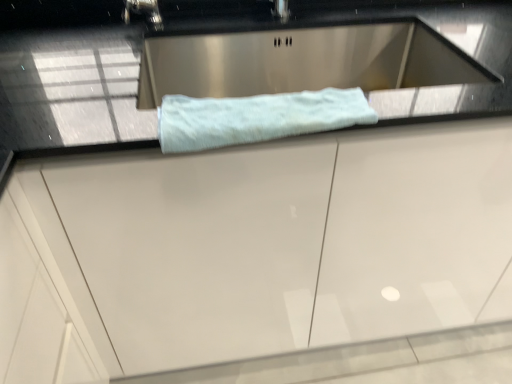
Question: Is white glossy cabinet at center oriented towards light blue plush towel at center?

Choices:
 (A) no
 (B) yes

Answer: (A)

Question: Is white glossy cabinet at center placed right next to light blue plush towel at center?

Choices:
 (A) yes
 (B) no

Answer: (B)

Question: Can you confirm if white glossy cabinet at center is shorter than light blue plush towel at center?

Choices:
 (A) no
 (B) yes

Answer: (A)

Question: From the image's perspective, is white glossy cabinet at center below light blue plush towel at center?

Choices:
 (A) yes
 (B) no

Answer: (A)

Question: Is white glossy cabinet at center surrounding light blue plush towel at center?

Choices:
 (A) yes
 (B) no

Answer: (A)

Question: Does white glossy cabinet at center have a larger size compared to light blue plush towel at center?

Choices:
 (A) no
 (B) yes

Answer: (B)

Question: Does light blue plush towel at center turn towards white glossy cabinet at center?

Choices:
 (A) no
 (B) yes

Answer: (B)

Question: Considering the relative sizes of light blue plush towel at center and white glossy cabinet at center in the image provided, is light blue plush towel at center bigger than white glossy cabinet at center?

Choices:
 (A) yes
 (B) no

Answer: (B)

Question: Is light blue plush towel at center smaller than white glossy cabinet at center?

Choices:
 (A) yes
 (B) no

Answer: (A)

Question: Is light blue plush towel at center beside white glossy cabinet at center?

Choices:
 (A) yes
 (B) no

Answer: (B)

Question: Is light blue plush towel at center to the right of white glossy cabinet at center from the viewer's perspective?

Choices:
 (A) no
 (B) yes

Answer: (A)

Question: Is light blue plush towel at center closer to the viewer compared to white glossy cabinet at center?

Choices:
 (A) yes
 (B) no

Answer: (B)

Question: In the image, is white glossy cabinet at center positioned in front of or behind light blue plush towel at center?

Choices:
 (A) behind
 (B) front

Answer: (B)